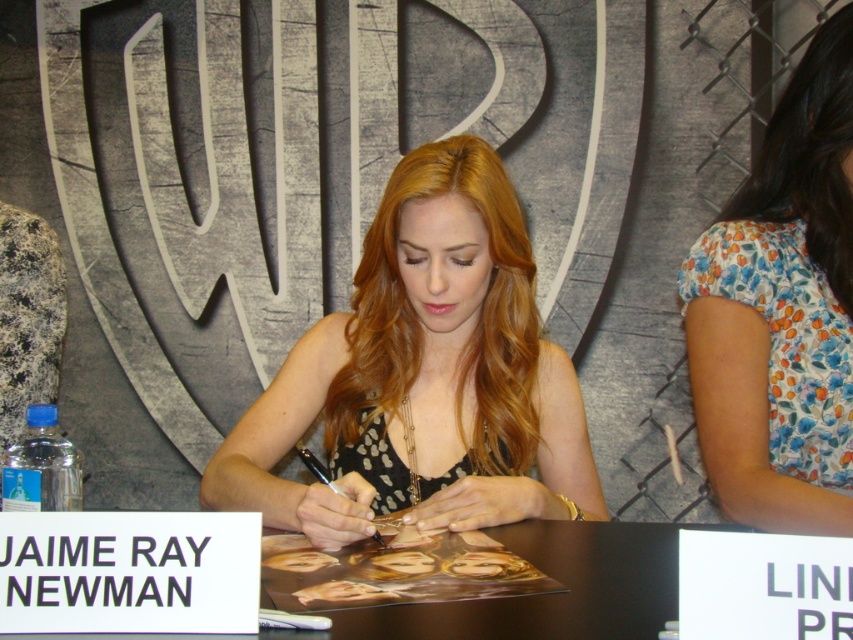
Question: Can you confirm if matte black dress at center is wider than black paper at center?

Choices:
 (A) no
 (B) yes

Answer: (B)

Question: Is matte black dress at center bigger than floral fabric shirt at right?

Choices:
 (A) yes
 (B) no

Answer: (A)

Question: Estimate the real-world distances between objects in this image. Which object is closer to the white paper at center?

Choices:
 (A) floral fabric shirt at right
 (B) black paper at center
 (C) matte black dress at center

Answer: (C)

Question: Which point is closer to the camera taking this photo?

Choices:
 (A) (816, 413)
 (B) (135, 579)
 (C) (451, 161)
 (D) (544, 611)

Answer: (B)

Question: Which object is positioned farthest from the floral fabric shirt at right?

Choices:
 (A) white paper at center
 (B) matte black dress at center

Answer: (A)

Question: Where is white paper at center located in relation to black paper at center in the image?

Choices:
 (A) above
 (B) below

Answer: (B)